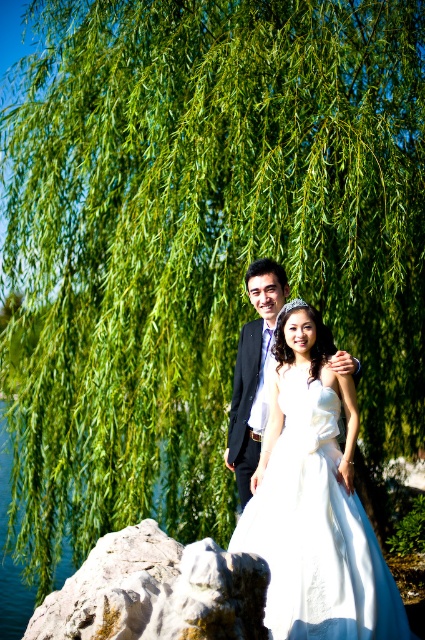
You are a photographer setting up for a wedding photo shoot. You notice a rough textured rock at lower left and a matte black suit at center in the scene. Which object would block more of the sunlight if placed in front of the camera lens?

The rough textured rock at lower left is bigger than the matte black suit at center, so it would block more sunlight if placed in front of the camera lens.

You are a photographer setting up for a wedding photo shoot. You want to ensure that the white satin dress at center is visible in the frame. Considering the rough textured rock at lower left is blocking part of the view, can you adjust your position so that the dress remains fully visible while the rock is partially visible?

The white satin dress at center is narrower than the rough textured rock at lower left. Since the dress is smaller in width, you can position yourself so that the rock partially obscures the edge of the dress while still keeping most of it visible in the frame.

You are a photographer setting up for a wedding photo shoot. The couple is standing under a weeping willow tree. The man is in a dark suit with a purple tie, and the woman is wearing a white satin dress at center. To ensure the dress is well lit, where should you position the main light source relative to the dress?

The white satin dress at center is located at point (316, 531). To ensure proper lighting, position the main light source in a direction that illuminates this coordinate effectively, considering the tree canopy and sunlight direction.